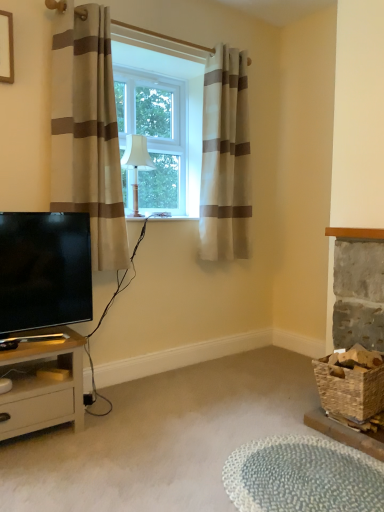
At what (x,y) coordinates should I click in order to perform the action: click on free space above textured gray rug at lower center (from a real-world perspective). Please return your answer as a coordinate pair (x, y). Image resolution: width=384 pixels, height=512 pixels. Looking at the image, I should click on (299, 474).